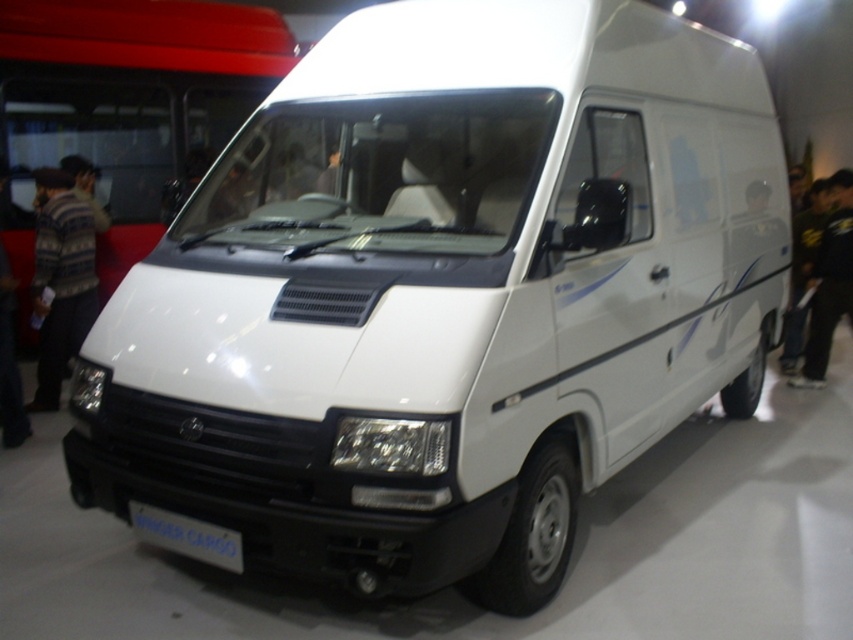
You are standing in front of the white commercial van at the exhibition. There is a point marked at coordinates (x=61, y=278). Can you determine what object is located at this point?

The point at coordinates (x=61, y=278) corresponds to the striped sweater at left.

You are a customer at a clothing store and see the striped sweater at left and the black fabric pants at right. Which item is closer to you?

The striped sweater at left is closer to you because it is in front of the black fabric pants at right.

You are trying to decide which item to pack first in your suitcase. You see a striped sweater at left and a black fabric pants at right. Which item requires less space?

The striped sweater at left has a smaller size compared to black fabric pants at right, so it requires less space.